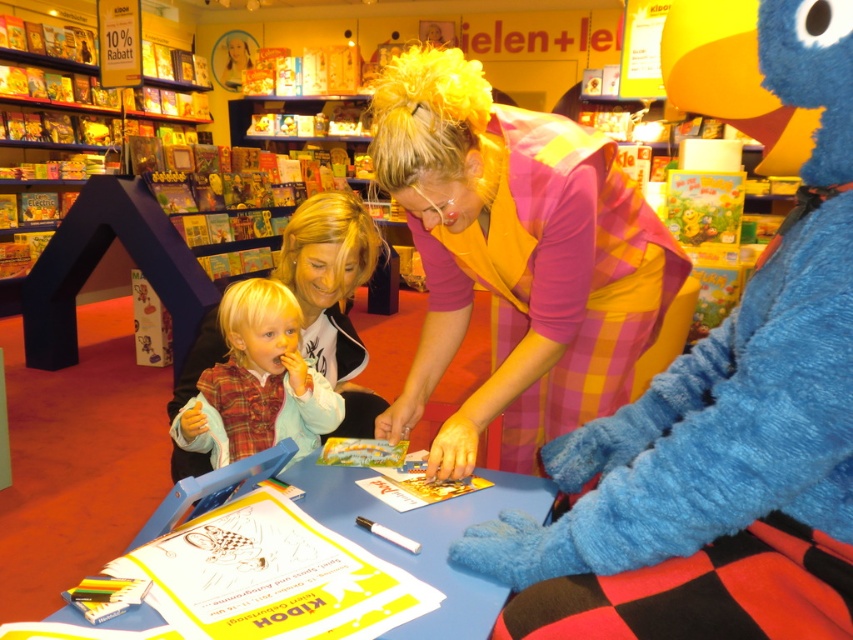
You are a store employee who needs to organize the plaid fabric shirt at center and the plaid wool sweater at lower left into a display. According to their positions in the image, which one should be placed higher on the shelf?

The plaid fabric shirt at center should be placed higher on the shelf since it is positioned above the plaid wool sweater at lower left in the image.